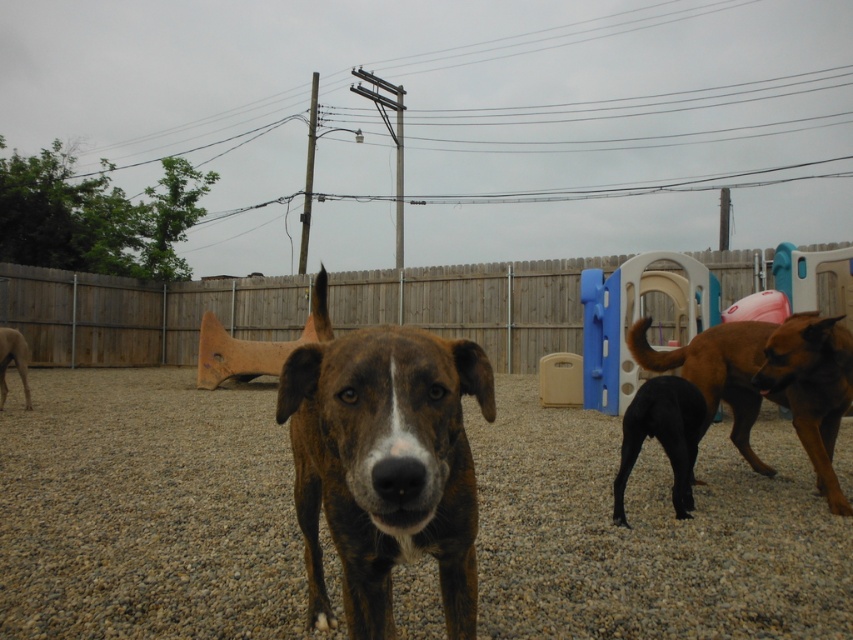
Question: Is brown textured dirt at center positioned before black smooth dog at right?

Choices:
 (A) no
 (B) yes

Answer: (B)

Question: Which object is positioned farthest from the black smooth dog at right?

Choices:
 (A) black matte dog at right
 (B) brown brindle dog at left
 (C) brown textured dirt at center

Answer: (B)

Question: Estimate the real-world distances between objects in this image. Which object is farther from the brown brindle dog at left?

Choices:
 (A) brown textured dirt at center
 (B) black matte dog at right
 (C) brown brindle dog at center
 (D) wooden fence at center

Answer: (D)

Question: Does brown textured dirt at center have a lesser width compared to black smooth dog at right?

Choices:
 (A) yes
 (B) no

Answer: (B)

Question: Can you confirm if black matte dog at right is positioned above brown brindle dog at left?

Choices:
 (A) no
 (B) yes

Answer: (A)

Question: Which of the following is the farthest from the observer?

Choices:
 (A) (425, 468)
 (B) (6, 362)
 (C) (671, 420)

Answer: (B)